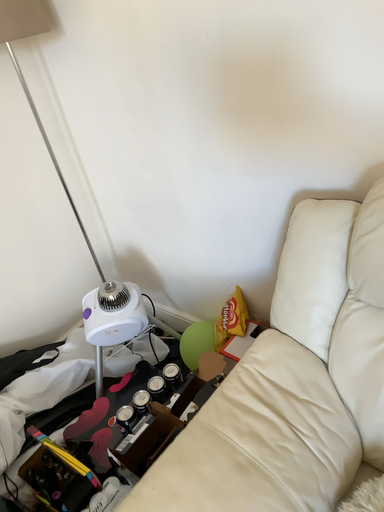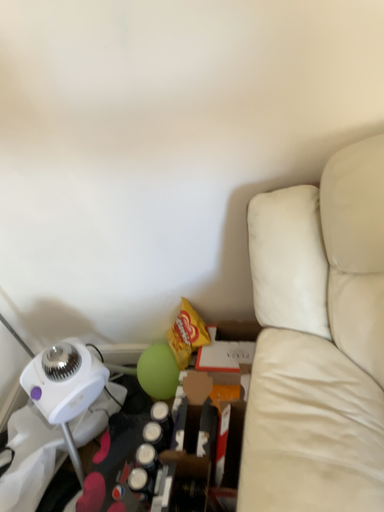
Question: Which way did the camera rotate in the video?

Choices:
 (A) rotated left
 (B) rotated right

Answer: (B)